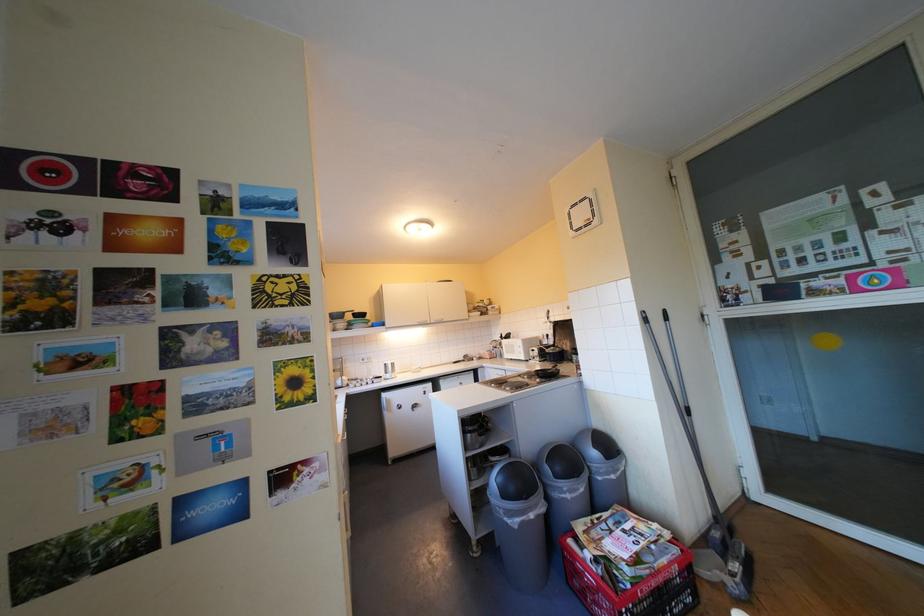
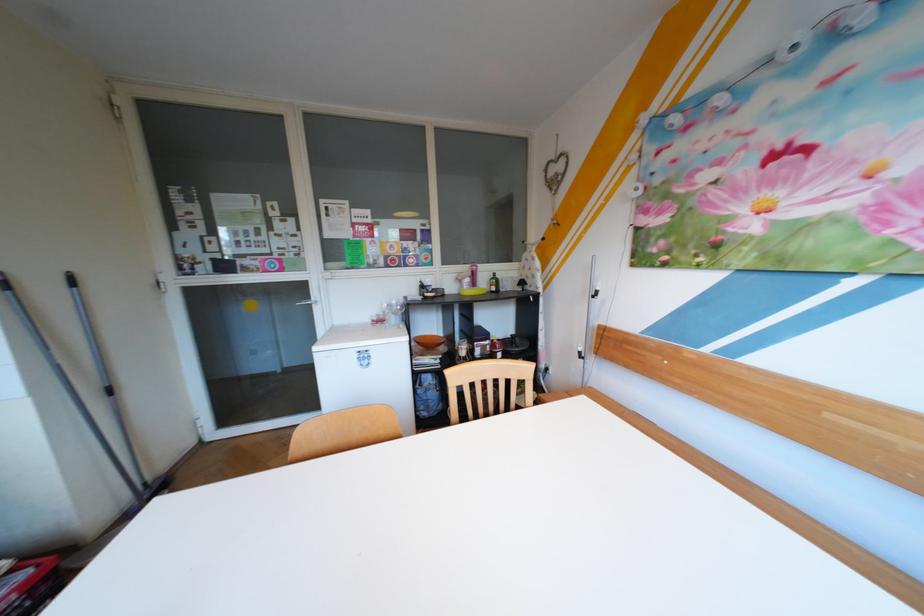
Question: The first image is from the beginning of the video and the second image is from the end. How did the camera likely rotate when shooting the video?

Choices:
 (A) Left
 (B) Right
 (C) Up
 (D) Down

Answer: (B)